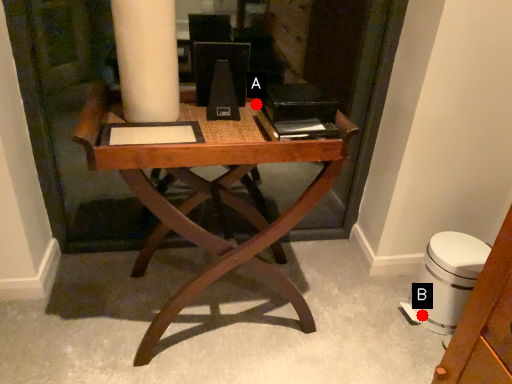
Question: Two points are circled on the image, labeled by A and B beside each circle. Which point is closer to the camera?

Choices:
 (A) A is closer
 (B) B is closer

Answer: (A)